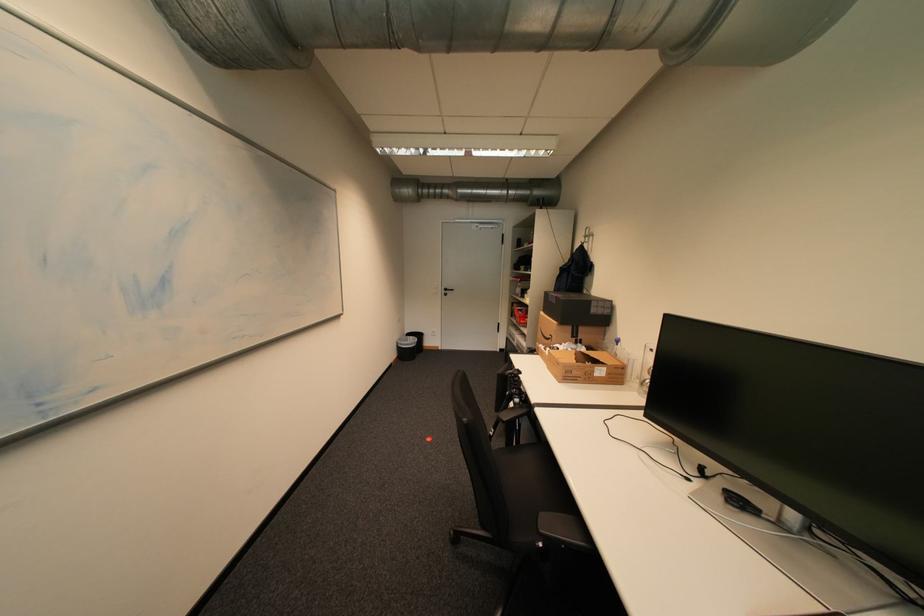
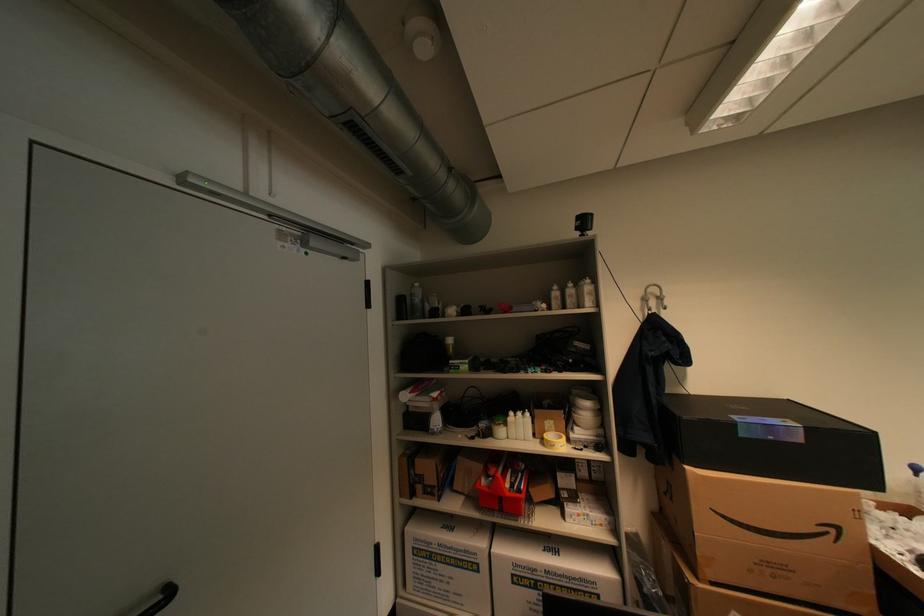
Find the pixel in the second image that matches (460,291) in the first image.

(176, 594)